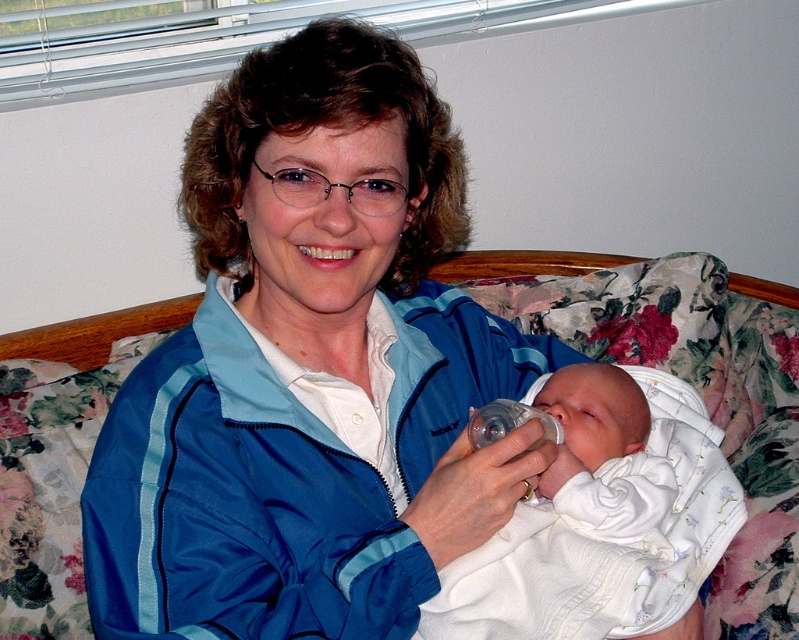
You are a fashion designer observing the scene. You need to determine which item is taller between the blue nylon jacket at center and the white soft cloth at center. Which one is taller?

The blue nylon jacket at center is taller than the white soft cloth at center according to the description.

You are a photographer setting up for a family portrait. You notice the blue nylon jacket at center and the white soft cloth at center in the scene. To ensure both items are visible in the frame, which item should you position closer to the center of the camera viewfinder?

The blue nylon jacket at center is to the left of white soft cloth at center, so positioning the white soft cloth at center closer to the center of the camera viewfinder would ensure both items are visible since it is already at the center.

You are a photographer taking a picture of the woman and baby. You notice a point at coordinate (231, 506). Which object is this point located on?

The point at coordinate (231, 506) is located on the blue nylon jacket at center.